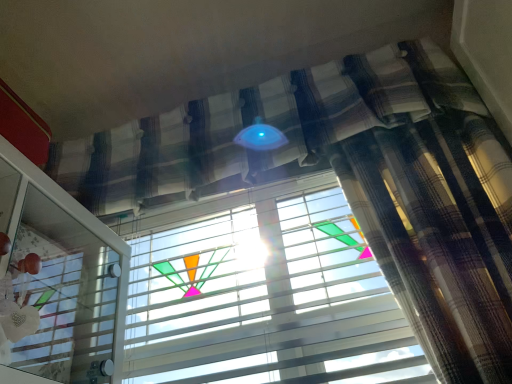
Question: From the image's perspective, is white plastic blinds at center above transparent glass screen door at lower left?

Choices:
 (A) yes
 (B) no

Answer: (B)

Question: Can you confirm if white plastic blinds at center is positioned to the left of transparent glass screen door at lower left?

Choices:
 (A) no
 (B) yes

Answer: (A)

Question: Considering the relative sizes of white plastic blinds at center and transparent glass screen door at lower left in the image provided, is white plastic blinds at center bigger than transparent glass screen door at lower left?

Choices:
 (A) no
 (B) yes

Answer: (A)

Question: Is white plastic blinds at center taller than transparent glass screen door at lower left?

Choices:
 (A) no
 (B) yes

Answer: (B)

Question: Is white plastic blinds at center behind transparent glass screen door at lower left?

Choices:
 (A) no
 (B) yes

Answer: (B)

Question: Is white plastic blinds at center positioned beyond the bounds of transparent glass screen door at lower left?

Choices:
 (A) yes
 (B) no

Answer: (A)

Question: Is transparent glass screen door at lower left looking in the opposite direction of white plastic blinds at center?

Choices:
 (A) no
 (B) yes

Answer: (A)

Question: Is transparent glass screen door at lower left wider than white plastic blinds at center?

Choices:
 (A) yes
 (B) no

Answer: (A)

Question: Does transparent glass screen door at lower left appear on the right side of white plastic blinds at center?

Choices:
 (A) yes
 (B) no

Answer: (B)

Question: Is transparent glass screen door at lower left facing towards white plastic blinds at center?

Choices:
 (A) yes
 (B) no

Answer: (B)

Question: Is transparent glass screen door at lower left smaller than white plastic blinds at center?

Choices:
 (A) yes
 (B) no

Answer: (B)

Question: Is transparent glass screen door at lower left positioned beyond the bounds of white plastic blinds at center?

Choices:
 (A) yes
 (B) no

Answer: (A)

Question: From a real-world perspective, is white plastic blinds at center physically located above or below transparent glass screen door at lower left?

Choices:
 (A) above
 (B) below

Answer: (A)